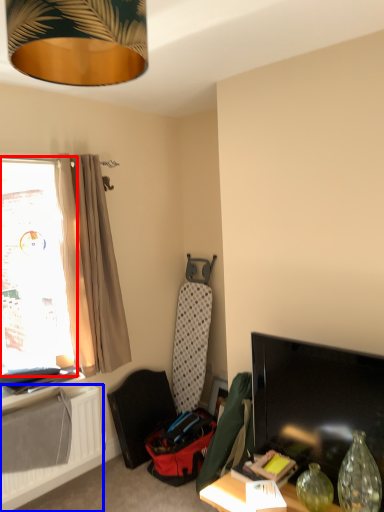
Question: Which object is further to the camera taking this photo, window (highlighted by a red box) or radiator (highlighted by a blue box)?

Choices:
 (A) window
 (B) radiator

Answer: (A)